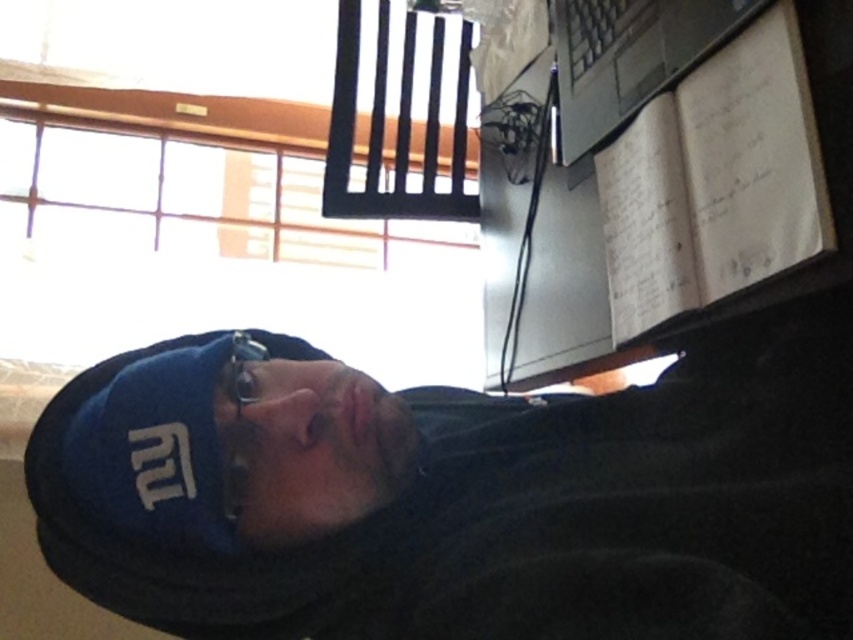
Question: Does black plastic laptop at upper right come behind metallic reflective glasses at center?

Choices:
 (A) no
 (B) yes

Answer: (B)

Question: Which point is closer to the camera taking this photo?

Choices:
 (A) (369, 474)
 (B) (241, 444)

Answer: (B)

Question: Is blue fabric cap at upper left smaller than metallic reflective glasses at center?

Choices:
 (A) yes
 (B) no

Answer: (B)

Question: Can you confirm if blue fabric cap at upper left is positioned above black plastic laptop at upper right?

Choices:
 (A) yes
 (B) no

Answer: (B)

Question: Which of the following is the closest to the observer?

Choices:
 (A) metallic reflective glasses at center
 (B) blue fabric cap at upper left
 (C) black plastic laptop at upper right

Answer: (B)

Question: Among these objects, which one is farthest from the camera?

Choices:
 (A) black plastic laptop at upper right
 (B) metallic reflective glasses at center

Answer: (A)